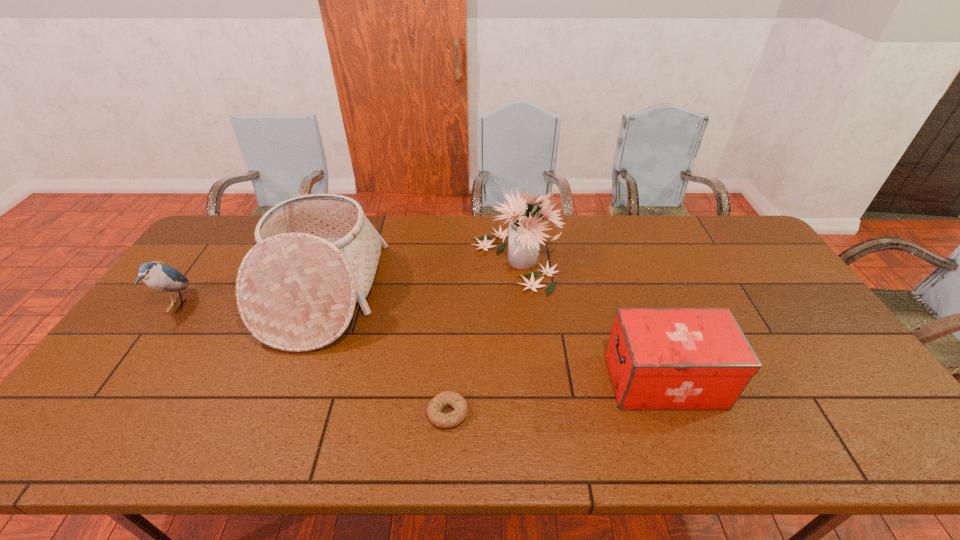
Locate an element on the screen. the third closest object relative to the basket is located at coordinates (525, 235).

At what (x,y) coordinates should I click in order to perform the action: click on the closest object to the basket. Please return your answer as a coordinate pair (x, y). Image resolution: width=960 pixels, height=540 pixels. Looking at the image, I should click on (161, 277).

You are a GUI agent. You are given a task and a screenshot of the screen. Output one action in this format:
    pyautogui.click(x=<x>, y=<y>)
    Task: Click on the free location that satisfies the following two spatial constraints: 1. at the tip of the bird's beak; 2. on the right side of the shortest object
    
    Given the screenshot: What is the action you would take?
    pyautogui.click(x=101, y=413)

Identify the location of vacant space that satisfies the following two spatial constraints: 1. on the handle side of the rightmost object; 2. on the front side of the shortest object. (676, 413).

The image size is (960, 540). I want to click on vacant area that satisfies the following two spatial constraints: 1. at the tip of the bagel's beak; 2. on the right side of the leftmost object, so click(x=101, y=413).

The height and width of the screenshot is (540, 960). In order to click on blank area in the image that satisfies the following two spatial constraints: 1. on the back side of the shortest object; 2. with the lid open on the basket in this screenshot , I will do `click(455, 293)`.

Find the location of `vacant space that satisfies the following two spatial constraints: 1. on the front side of the bouquet; 2. with the lid open on the fourth object from right to left`. vacant space that satisfies the following two spatial constraints: 1. on the front side of the bouquet; 2. with the lid open on the fourth object from right to left is located at coordinates (517, 293).